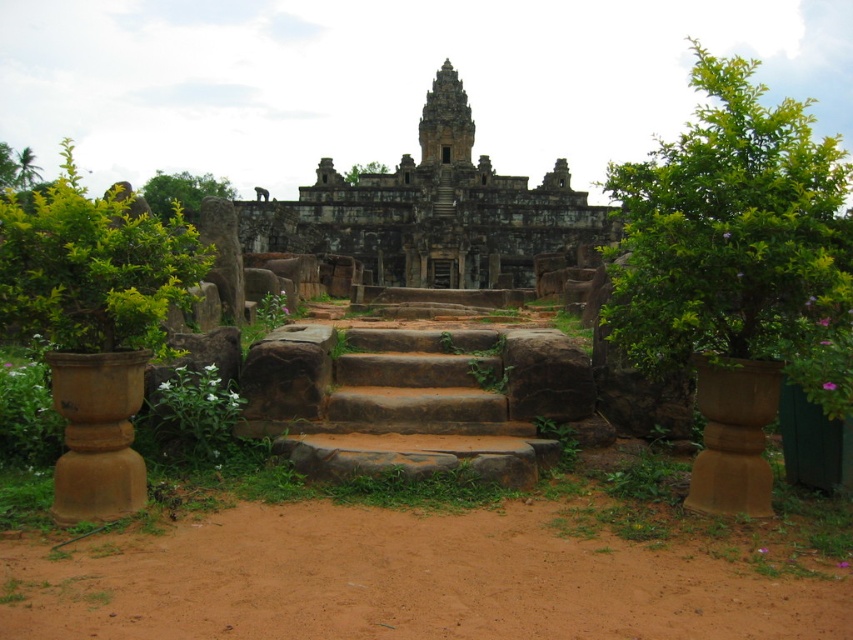
Between point (672, 305) and point (15, 157), which one is positioned behind?

The point (15, 157) is behind.

Is point (630, 177) in front of point (16, 157)?

Yes, point (630, 177) is in front of point (16, 157).

Locate an element on the screen. This screenshot has height=640, width=853. green leafy tree at upper right is located at coordinates (730, 230).

The width and height of the screenshot is (853, 640). Identify the location of green leafy tree at upper right. (730, 230).

From the picture: Is brown soil at lower center thinner than green leafy tree at upper center?

In fact, brown soil at lower center might be wider than green leafy tree at upper center.

Does brown soil at lower center have a lesser height compared to green leafy tree at upper center?

Yes.

Which is behind, point (654, 556) or point (216, 186)?

Point (216, 186)

Identify the location of brown soil at lower center. Image resolution: width=853 pixels, height=640 pixels. (405, 580).

Which is more to the left, green leafy bush at left or green leafy tree at upper left?

Positioned to the left is green leafy tree at upper left.

Can you confirm if green leafy bush at left is positioned above green leafy tree at upper left?

No, green leafy bush at left is not above green leafy tree at upper left.

Is point (195, 244) closer to viewer compared to point (28, 163)?

Yes.

At what (x,y) coordinates should I click in order to perform the action: click on green leafy bush at left. Please return your answer as a coordinate pair (x, y). This screenshot has width=853, height=640. Looking at the image, I should click on [x=91, y=266].